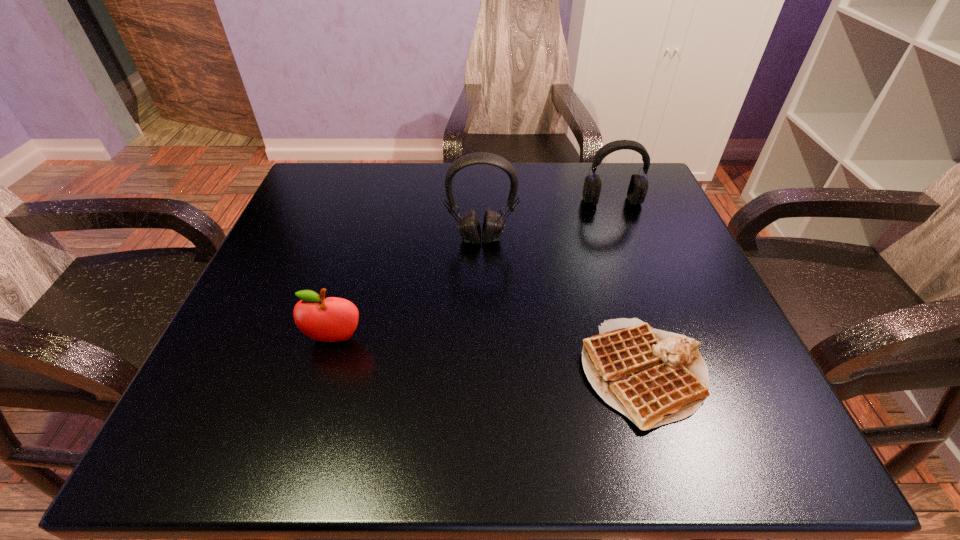
Where is `the tallest object`? The width and height of the screenshot is (960, 540). the tallest object is located at coordinates (468, 225).

I want to click on the left headset, so click(x=468, y=225).

You are a GUI agent. You are given a task and a screenshot of the screen. Output one action in this format:
    pyautogui.click(x=<x>, y=<y>)
    Task: Click on the second tallest object
    Image resolution: width=960 pixels, height=540 pixels.
    Given the screenshot: What is the action you would take?
    pyautogui.click(x=638, y=186)

You are a GUI agent. You are given a task and a screenshot of the screen. Output one action in this format:
    pyautogui.click(x=<x>, y=<y>)
    Task: Click on the farthest object
    This screenshot has height=540, width=960.
    Given the screenshot: What is the action you would take?
    pos(638,186)

Identify the location of apple. This screenshot has width=960, height=540. (332, 319).

What are the coordinates of `the leftmost object` in the screenshot? It's located at (332, 319).

You are a GUI agent. You are given a task and a screenshot of the screen. Output one action in this format:
    pyautogui.click(x=<x>, y=<y>)
    Task: Click on the waffle
    
    Given the screenshot: What is the action you would take?
    pyautogui.click(x=654, y=377)

Find the location of a particular element. vacant area located 0.170m on the front-facing side of the left headset is located at coordinates (x=482, y=310).

Where is `free location located 0.220m on the headband of the right headset`? The image size is (960, 540). free location located 0.220m on the headband of the right headset is located at coordinates (640, 278).

This screenshot has width=960, height=540. I want to click on vacant area situated on the back of the apple, so click(373, 211).